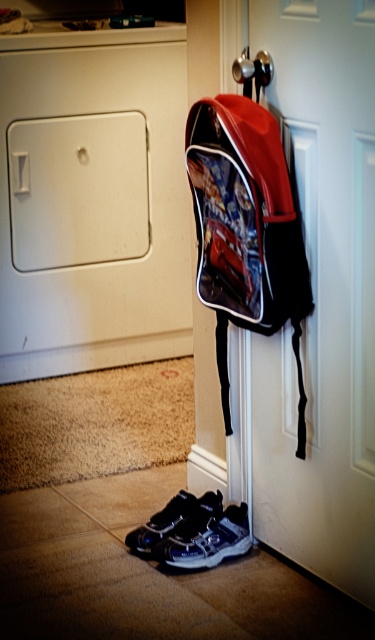
Question: Based on their relative distances, which object is farther from the shiny red backpack at door?

Choices:
 (A) shiny black sneakers at lower center
 (B) white matte door at center
 (C) shiny black sneaker at lower center

Answer: (C)

Question: Which object appears farthest from the camera in this image?

Choices:
 (A) white matte door at center
 (B) shiny black sneaker at lower center

Answer: (B)

Question: Is white matte door at center positioned before shiny red backpack at door?

Choices:
 (A) yes
 (B) no

Answer: (A)

Question: Where is shiny red backpack at door located in relation to shiny black sneakers at lower center in the image?

Choices:
 (A) above
 (B) below

Answer: (A)

Question: Which point appears farthest from the camera in this image?

Choices:
 (A) (351, 275)
 (B) (130, 536)

Answer: (B)

Question: Considering the relative positions of shiny red backpack at door and shiny black sneakers at lower center in the image provided, where is shiny red backpack at door located with respect to shiny black sneakers at lower center?

Choices:
 (A) below
 (B) above

Answer: (B)